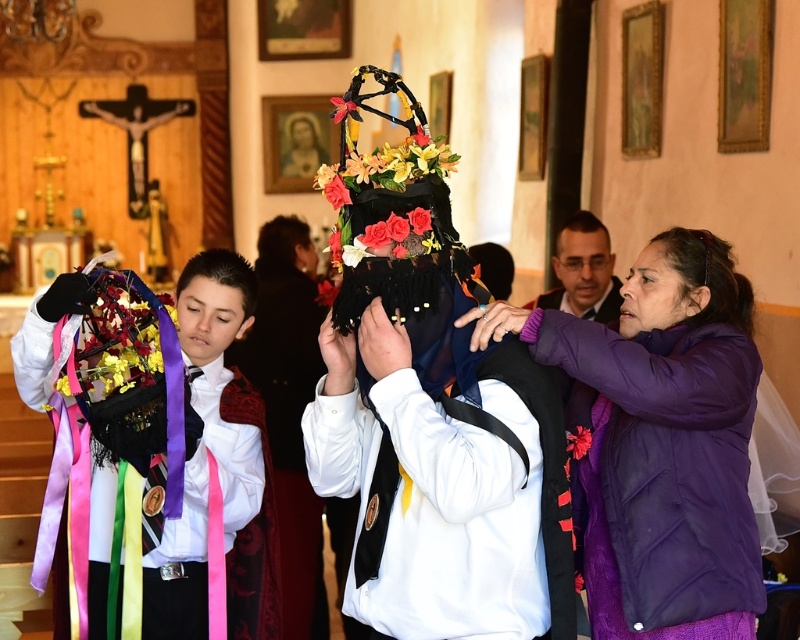
Question: Which point is closer to the camera?

Choices:
 (A) purple fleece jacket at right
 (B) purple puffy jacket at right

Answer: (A)

Question: Which of the following is the farthest from the observer?

Choices:
 (A) purple puffy jacket at right
 (B) dark brown hair at center
 (C) black velvet headdress at center

Answer: (B)

Question: Does matte black hair at left appear on the right side of purple puffy jacket at right?

Choices:
 (A) yes
 (B) no

Answer: (B)

Question: Among these objects, which one is nearest to the camera?

Choices:
 (A) purple fleece jacket at right
 (B) matte black head at center
 (C) black velvet headdress at center
 (D) matte black hair at left

Answer: (A)

Question: Is purple soft jacket at center positioned behind matte black head at center?

Choices:
 (A) yes
 (B) no

Answer: (B)

Question: Can you confirm if matte black head at center is smaller than black velvet headdress at center?

Choices:
 (A) yes
 (B) no

Answer: (A)